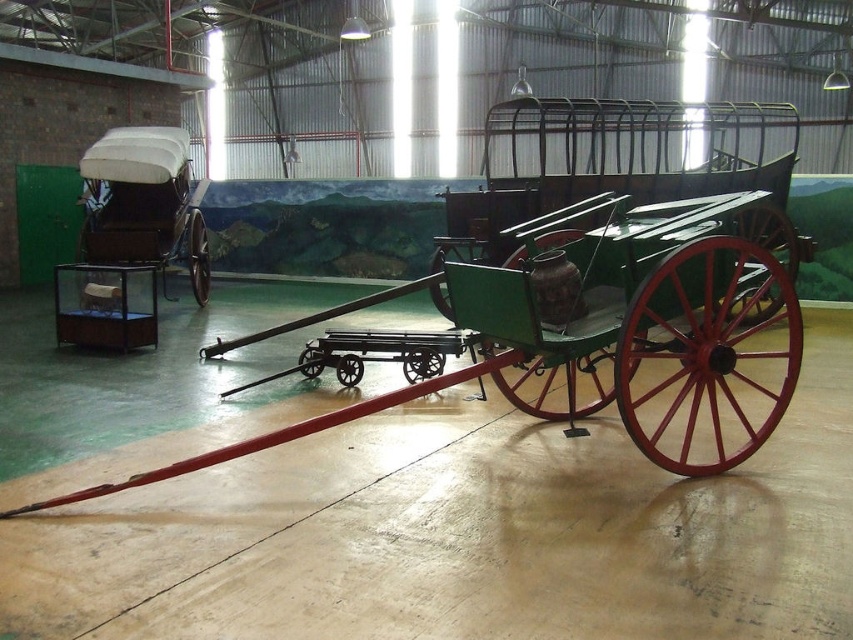
Can you confirm if green polished wood horse cart at center is wider than white fabric covered wagon at left?

Correct, the width of green polished wood horse cart at center exceeds that of white fabric covered wagon at left.

Is green polished wood horse cart at center closer to the viewer compared to white fabric covered wagon at left?

That is True.

Which is behind, point (440, 387) or point (207, 246)?

The point (207, 246) is behind.

You are a GUI agent. You are given a task and a screenshot of the screen. Output one action in this format:
    pyautogui.click(x=<x>, y=<y>)
    Task: Click on the green polished wood horse cart at center
    The image size is (853, 640).
    Given the screenshot: What is the action you would take?
    pyautogui.click(x=606, y=276)